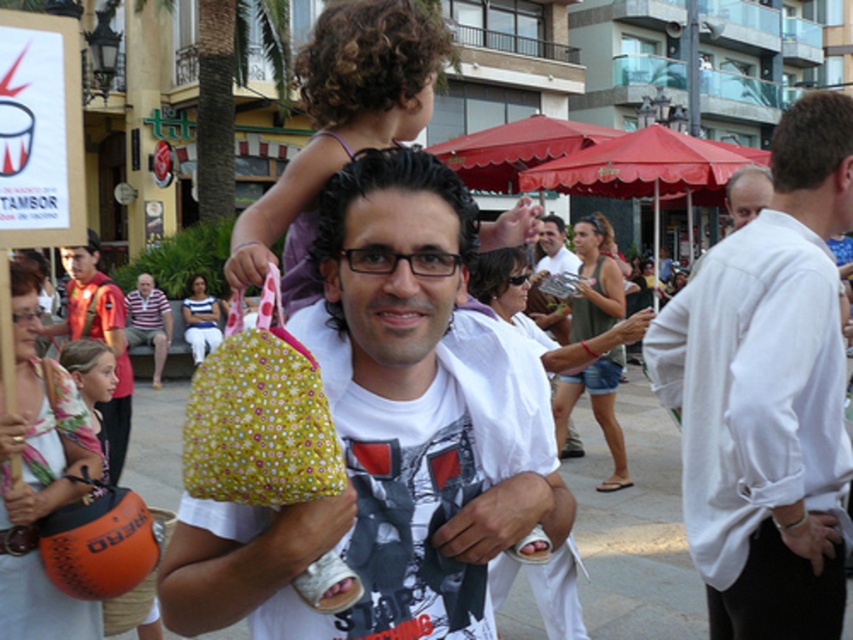
Is floral fabric bag at center taller than white paper sign at upper left?

Correct, floral fabric bag at center is much taller as white paper sign at upper left.

Does floral fabric bag at center have a lesser width compared to white paper sign at upper left?

No, floral fabric bag at center is not thinner than white paper sign at upper left.

What do you see at coordinates (392, 436) in the screenshot?
I see `floral fabric bag at center` at bounding box center [392, 436].

What are the coordinates of `floral fabric bag at center` in the screenshot? It's located at (392, 436).

Is point (729, 285) behind point (67, 452)?

No, (729, 285) is in front of (67, 452).

Who is more distant from viewer, [816,336] or [16,536]?

The point [16,536] is behind.

The height and width of the screenshot is (640, 853). I want to click on white cotton shirt at right, so click(x=769, y=394).

Consider the image. Can you confirm if curly-haired girl at center is taller than striped polo shirt at center?

No, curly-haired girl at center is not taller than striped polo shirt at center.

Between point (323, 102) and point (154, 323), which one is positioned behind?

The point (154, 323) is more distant.

The height and width of the screenshot is (640, 853). Describe the element at coordinates (341, 125) in the screenshot. I see `curly-haired girl at center` at that location.

The width and height of the screenshot is (853, 640). Identify the location of curly-haired girl at center. (341, 125).